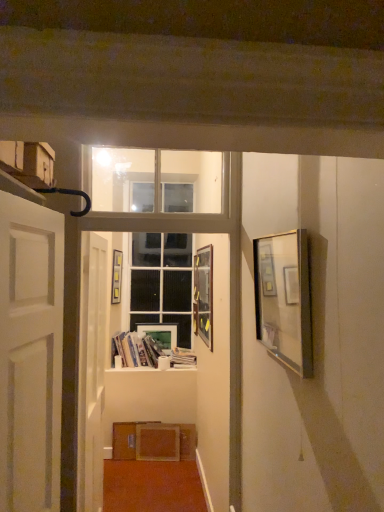
The width and height of the screenshot is (384, 512). Describe the element at coordinates (203, 295) in the screenshot. I see `metallic silver picture frame at center, marked as the 3th picture frame in a left-to-right arrangement` at that location.

What do you see at coordinates (160, 333) in the screenshot?
I see `matte white picture frame at center, the 2th picture frame viewed from the left` at bounding box center [160, 333].

Identify the location of matte white picture frame at center, positioned as the fourth picture frame in front-to-back order. (160, 333).

From the picture: What is the approximate width of hardcover books at center, the 2th book when ordered from right to left?

hardcover books at center, the 2th book when ordered from right to left, is 12.55 inches wide.

Locate an element on the screen. The height and width of the screenshot is (512, 384). wooden picture frame at center, the fourth picture frame from the right is located at coordinates (116, 276).

The width and height of the screenshot is (384, 512). Identify the location of white glass door at center. (162, 282).

From a real-world perspective, which object stands above the other?

white glossy door at center, the first door when ordered from back to front, is physically above.

Is hardcover books at center, arranged as the first book when viewed from the left, to the left of white glossy door at center, which is counted as the 2th door, starting from the front, from the viewer's perspective?

Incorrect, hardcover books at center, arranged as the first book when viewed from the left, is not on the left side of white glossy door at center, which is counted as the 2th door, starting from the front.

You are a GUI agent. You are given a task and a screenshot of the screen. Output one action in this format:
    pyautogui.click(x=<x>, y=<y>)
    Task: Click on the door that is the 1st one when counting upward from the hardcover books at center, the 2th book when ordered from right to left (from the image's perspective)
    
    Given the screenshot: What is the action you would take?
    pyautogui.click(x=91, y=371)

Between hardcover books at center, arranged as the first book when viewed from the left, and white glossy door at center, which is counted as the 2th door, starting from the front, which one has less height?

hardcover books at center, arranged as the first book when viewed from the left.

From the image's perspective, is white matte door at left, which appears as the 1th door when viewed from the front, beneath matte white picture frame at center, positioned as the fourth picture frame in front-to-back order?

No.

Where is `the 2nd door above the matte white picture frame at center, positioned as the fourth picture frame in front-to-back order (from the image's perspective)`? This screenshot has height=512, width=384. the 2nd door above the matte white picture frame at center, positioned as the fourth picture frame in front-to-back order (from the image's perspective) is located at coordinates (30, 355).

Between point (47, 507) and point (176, 339), which one is positioned behind?

The point (176, 339) is behind.

Between white matte door at left, which ranks as the second door in back-to-front order, and matte white picture frame at center, the 2th picture frame viewed from the left, which one has smaller width?

matte white picture frame at center, the 2th picture frame viewed from the left.

Would you say metallic silver picture frame at center, which is the 2th picture frame in front-to-back order, is outside matte white picture frame at center, which appears as the 3th picture frame when viewed from the right?

metallic silver picture frame at center, which is the 2th picture frame in front-to-back order, lies outside matte white picture frame at center, which appears as the 3th picture frame when viewed from the right,'s area.

Can you tell me how much metallic silver picture frame at center, which appears as the third picture frame when viewed from the back, and matte white picture frame at center, the first picture frame when ordered from back to front, differ in facing direction?

metallic silver picture frame at center, which appears as the third picture frame when viewed from the back, and matte white picture frame at center, the first picture frame when ordered from back to front, are facing 89.5 degrees away from each other.

Considering the sizes of metallic silver picture frame at center, the second picture frame in the right-to-left sequence, and matte white picture frame at center, the 2th picture frame viewed from the left, in the image, is metallic silver picture frame at center, the second picture frame in the right-to-left sequence, wider or thinner than matte white picture frame at center, the 2th picture frame viewed from the left,?

Clearly, metallic silver picture frame at center, the second picture frame in the right-to-left sequence, has more width compared to matte white picture frame at center, the 2th picture frame viewed from the left.

The height and width of the screenshot is (512, 384). Identify the location of the 1st picture frame counting from the right side of the matte white picture frame at center, which appears as the 3th picture frame when viewed from the right. (203, 295).

Who is smaller, white matte door at left, which ranks as the second door in back-to-front order, or hardcover book at center, the first book in the right-to-left sequence?

Smaller between the two is hardcover book at center, the first book in the right-to-left sequence.

From a real-world perspective, who is located higher, white matte door at left, which appears as the 1th door when viewed from the front, or hardcover book at center, the first book in the right-to-left sequence?

white matte door at left, which appears as the 1th door when viewed from the front, from a real-world perspective.

Considering the positions of points (52, 416) and (186, 366), is point (52, 416) farther from camera compared to point (186, 366)?

No, (52, 416) is closer to viewer.

Where is `picture frame that is the 2nd object located above the white glossy door at center, the first door when ordered from back to front (from the image's perspective)`? picture frame that is the 2nd object located above the white glossy door at center, the first door when ordered from back to front (from the image's perspective) is located at coordinates (116, 276).

Looking at this image, can you confirm if wooden picture frame at center, the fourth picture frame from the right, is taller than white glossy door at center, which is counted as the 2th door, starting from the front?

No.

Which is less distant, [116,303] or [96,496]?

Point [116,303] appears to be farther away from the viewer than point [96,496].

From a real-world perspective, is wooden picture frame at center, which is the 3th picture frame in front-to-back order, below white glossy door at center, the first door when ordered from back to front?

No, from a real-world perspective, wooden picture frame at center, which is the 3th picture frame in front-to-back order, is not under white glossy door at center, the first door when ordered from back to front.

Based on the photo, does hardcover book at center, the second book when ordered from left to right, touch wooden picture frame at center, the fourth picture frame from the right?

No, hardcover book at center, the second book when ordered from left to right, is not making contact with wooden picture frame at center, the fourth picture frame from the right.

Based on the photo, which of these two, hardcover book at center, the first book in the right-to-left sequence, or wooden picture frame at center, the fourth picture frame from the right, stands shorter?

With less height is hardcover book at center, the first book in the right-to-left sequence.

Considering the positions of objects hardcover book at center, the second book when ordered from left to right, and wooden picture frame at center, the 1th picture frame positioned from the left, in the image provided, who is more to the left, hardcover book at center, the second book when ordered from left to right, or wooden picture frame at center, the 1th picture frame positioned from the left,?

From the viewer's perspective, wooden picture frame at center, the 1th picture frame positioned from the left, appears more on the left side.

Measure the distance from hardcover book at center, the first book in the right-to-left sequence, to wooden picture frame at center, acting as the second picture frame starting from the back.

They are 34.62 inches apart.

From the image's perspective, is matte white picture frame at center, positioned as the fourth picture frame in front-to-back order, over white matte door at left, which ranks as the second door in back-to-front order?

No, from the image's perspective, matte white picture frame at center, positioned as the fourth picture frame in front-to-back order, is not above white matte door at left, which ranks as the second door in back-to-front order.

How much distance is there between matte white picture frame at center, the 2th picture frame viewed from the left, and white matte door at left, which appears as the 1th door when viewed from the front?

They are 2.92 meters apart.

From a real-world perspective, is matte white picture frame at center, positioned as the fourth picture frame in front-to-back order, under white matte door at left, which ranks as the second door in back-to-front order?

Indeed, from a real-world perspective, matte white picture frame at center, positioned as the fourth picture frame in front-to-back order, is positioned beneath white matte door at left, which ranks as the second door in back-to-front order.

Is matte white picture frame at center, the first picture frame when ordered from back to front, looking in the opposite direction of white matte door at left, which ranks as the second door in back-to-front order?

No, white matte door at left, which ranks as the second door in back-to-front order, is not at the back of matte white picture frame at center, the first picture frame when ordered from back to front.

You are a GUI agent. You are given a task and a screenshot of the screen. Output one action in this format:
    pyautogui.click(x=<x>, y=<y>)
    Task: Click on the 1st book below the white glossy door at center, which is counted as the 2th door, starting from the front (from a real-world perspective)
    The image size is (384, 512).
    Given the screenshot: What is the action you would take?
    pyautogui.click(x=146, y=351)

Where is `door above the matte white picture frame at center, positioned as the fourth picture frame in front-to-back order (from a real-world perspective)`? door above the matte white picture frame at center, positioned as the fourth picture frame in front-to-back order (from a real-world perspective) is located at coordinates (30, 355).

Based on their spatial positions, is metallic silver picture frame at center, which appears as the third picture frame when viewed from the back, or wooden picture frame at center, the fourth picture frame from the right, closer to clear glass window frame at upper center?

Based on the image, metallic silver picture frame at center, which appears as the third picture frame when viewed from the back, appears to be nearer to clear glass window frame at upper center.

Estimate the real-world distances between objects in this image. Which object is closer to clear glass window frame at upper center, white glass door at center or hardcover books at center, the 2th book when ordered from right to left?

white glass door at center is closer to clear glass window frame at upper center.

Based on their spatial positions, is metallic silver picture frame at right, the fourth picture frame in the left-to-right sequence, or hardcover books at center, arranged as the first book when viewed from the left, closer to clear glass window frame at upper center?

Among the two, metallic silver picture frame at right, the fourth picture frame in the left-to-right sequence, is located nearer to clear glass window frame at upper center.

When comparing their distances from wooden picture frame at center, the 1th picture frame positioned from the left, does matte cardboard box at upper left or white glass door at center seem closer?

Among the two, white glass door at center is located nearer to wooden picture frame at center, the 1th picture frame positioned from the left.

In the scene shown: Looking at the image, which one is located further to matte cardboard box at upper left, metallic silver picture frame at center, which appears as the third picture frame when viewed from the back, or hardcover book at center, the second book when ordered from left to right?

hardcover book at center, the second book when ordered from left to right.

From the image, which object appears to be farther from white glass door at center, white glossy door at center, the first door when ordered from back to front, or matte white picture frame at center, positioned as the fourth picture frame in front-to-back order?

Among the two, white glossy door at center, the first door when ordered from back to front, is located further to white glass door at center.

Estimate the real-world distances between objects in this image. Which object is closer to clear glass window frame at upper center, wooden picture frame at center, the fourth picture frame from the right, or matte cardboard box at upper left?

matte cardboard box at upper left is closer to clear glass window frame at upper center.

When comparing their distances from wooden picture frame at center, acting as the second picture frame starting from the back, does white glass door at center or metallic silver picture frame at right, the fourth picture frame in the left-to-right sequence, seem further?

metallic silver picture frame at right, the fourth picture frame in the left-to-right sequence.

Locate an element on the screen. The height and width of the screenshot is (512, 384). window frame positioned between white matte door at left, which ranks as the second door in back-to-front order, and wooden picture frame at center, the 1th picture frame positioned from the left, from near to far is located at coordinates (179, 214).

This screenshot has width=384, height=512. Identify the location of picture frame between matte cardboard box at upper left and hardcover books at center, the 2th book when ordered from right to left, along the z-axis. (203, 295).

Image resolution: width=384 pixels, height=512 pixels. What are the coordinates of `picture frame between metallic silver picture frame at right, the fourth picture frame in the left-to-right sequence, and wooden picture frame at center, the fourth picture frame from the right, from front to back` in the screenshot? It's located at (203, 295).

I want to click on book between metallic silver picture frame at center, which is the 2th picture frame in front-to-back order, and wooden picture frame at center, the 1th picture frame positioned from the left, in the front-back direction, so click(x=146, y=351).